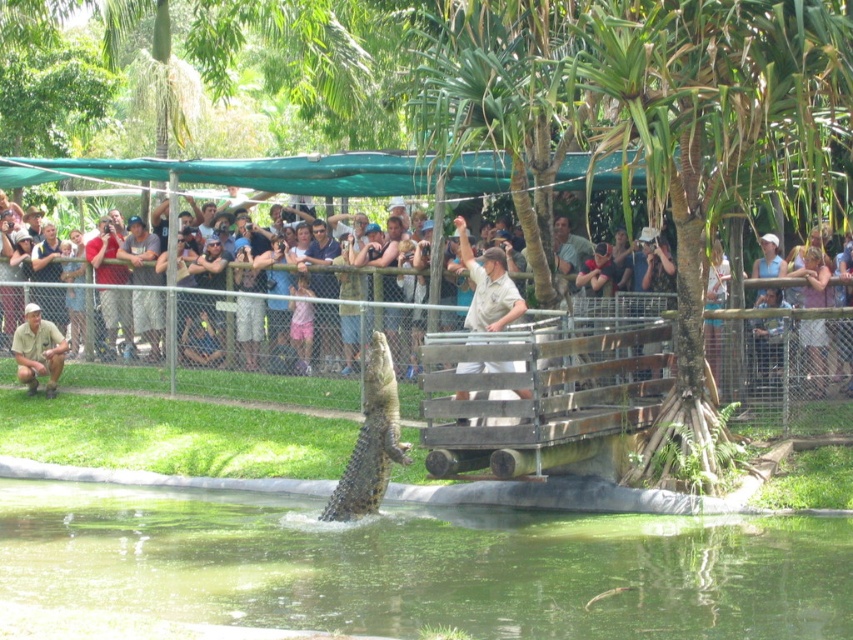
Question: Can you confirm if matte green fence at center is positioned to the right of khaki uniform at lower left?

Choices:
 (A) no
 (B) yes

Answer: (B)

Question: Which point is closer to the camera taking this photo?

Choices:
 (A) (483, 268)
 (B) (252, 524)
 (C) (381, 413)

Answer: (C)

Question: Which object is positioned closest to the greenish water at center?

Choices:
 (A) leathery brown crocodile at center
 (B) khaki uniform at lower left

Answer: (A)

Question: Which is farther from the khaki uniform at center?

Choices:
 (A) greenish water at center
 (B) matte green fence at center

Answer: (B)

Question: Can you confirm if matte green fence at center is positioned to the right of khaki uniform at center?

Choices:
 (A) no
 (B) yes

Answer: (A)

Question: Is leathery brown crocodile at center below khaki uniform at center?

Choices:
 (A) yes
 (B) no

Answer: (A)